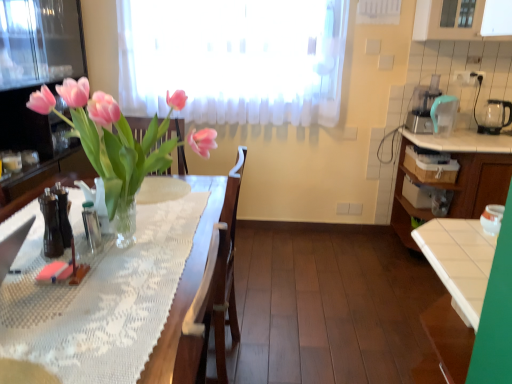
Image resolution: width=512 pixels, height=384 pixels. Find the location of `vacant point to the right of teal plastic blender at upper right, which ranks as the second appliance in top-to-bottom order`. vacant point to the right of teal plastic blender at upper right, which ranks as the second appliance in top-to-bottom order is located at coordinates (468, 146).